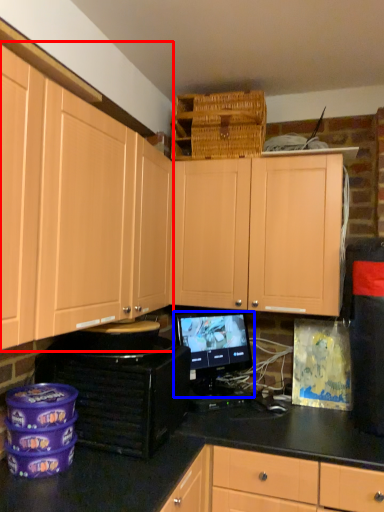
Question: Which of the following is the closest to the observer, cabinetry (highlighted by a red box) or computer monitor (highlighted by a blue box)?

Choices:
 (A) cabinetry
 (B) computer monitor

Answer: (A)